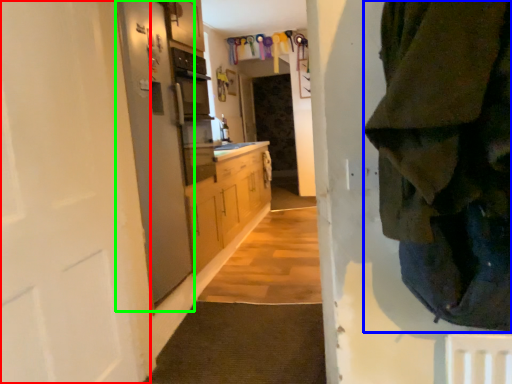
Question: Estimate the real-world distances between objects in this image. Which object is farther from door (highlighted by a red box), clothing (highlighted by a blue box) or screen door (highlighted by a green box)?

Choices:
 (A) clothing
 (B) screen door

Answer: (A)